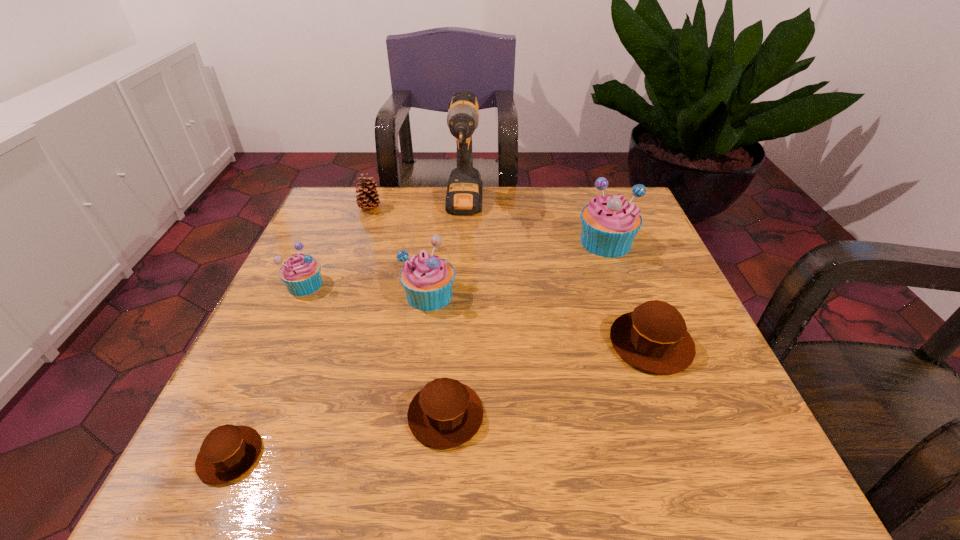
This screenshot has height=540, width=960. Identify the location of free spot between the second smallest blue muffin and the shortest muffin. (330, 375).

The width and height of the screenshot is (960, 540). Identify the location of vacant area between the drill and the farthest blue muffin. (535, 225).

Find the location of a particular element. The width and height of the screenshot is (960, 540). free space that is in between the third nearest muffin and the second tallest muffin is located at coordinates (540, 319).

Where is `free space between the biggest blue muffin and the second biggest brown muffin`? Image resolution: width=960 pixels, height=540 pixels. free space between the biggest blue muffin and the second biggest brown muffin is located at coordinates (526, 329).

Find the location of a particular element. the closest object to the pinecone is located at coordinates (464, 191).

Where is `object that stands as the sixth closest to the third object from left to right`? This screenshot has width=960, height=540. object that stands as the sixth closest to the third object from left to right is located at coordinates (229, 451).

This screenshot has width=960, height=540. What are the coordinates of `muffin that can be found as the closest to the leftmost brown muffin` in the screenshot? It's located at (445, 414).

Image resolution: width=960 pixels, height=540 pixels. I want to click on muffin that is the second nearest to the third nearest muffin, so click(x=445, y=414).

Locate an element on the screen. The width and height of the screenshot is (960, 540). the second closest blue muffin to the pinecone is located at coordinates pos(427,279).

Select which blue muffin is the second closest to the fifth tallest muffin. Please provide its 2D coordinates. Your answer should be formatted as a tuple, i.e. [(x, y)], where the tuple contains the x and y coordinates of a point satisfying the conditions above.

[(300, 273)]